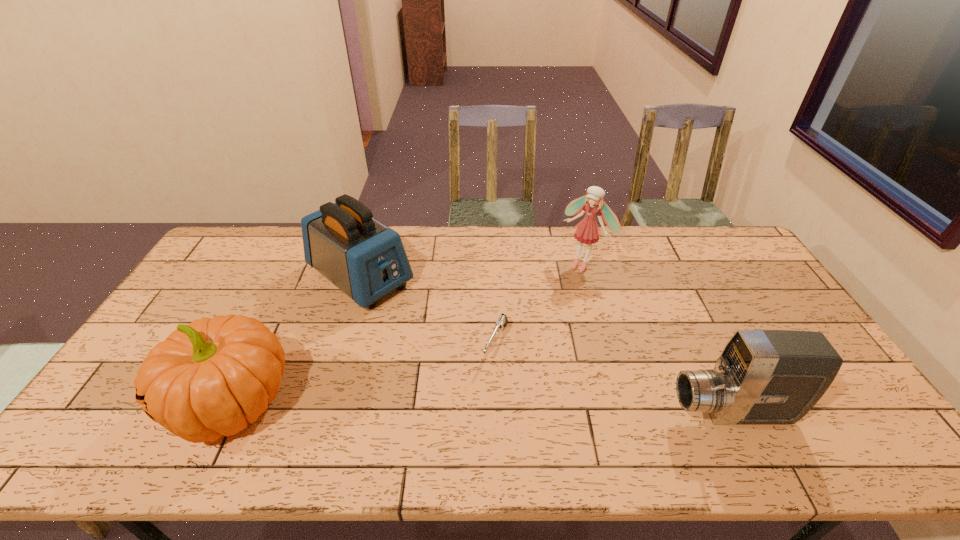
Identify the location of vacant area located at the front of the camcorder, highlighting the lens. This screenshot has height=540, width=960. (x=544, y=413).

Where is `vacant space located at the front of the camcorder, highlighting the lens`? This screenshot has height=540, width=960. vacant space located at the front of the camcorder, highlighting the lens is located at coordinates (569, 413).

Find the location of a particular element. The width and height of the screenshot is (960, 540). free space located on the front-facing side of the second object from right to left is located at coordinates [x=543, y=306].

Where is `free spot located on the front-facing side of the second object from right to left`? The image size is (960, 540). free spot located on the front-facing side of the second object from right to left is located at coordinates (564, 282).

At what (x,y) coordinates should I click in order to perform the action: click on free spot located 0.070m on the front-facing side of the second object from right to left. Please return your answer as a coordinate pair (x, y). Looking at the image, I should click on (562, 285).

The image size is (960, 540). I want to click on vacant space located on the front-facing side of the shortest object, so 474,401.

The image size is (960, 540). In order to click on vacant space situated on the front-facing side of the shortest object in this screenshot , I will do `click(477, 395)`.

Where is `free space located 0.070m on the front-facing side of the shortest object`? free space located 0.070m on the front-facing side of the shortest object is located at coordinates (482, 386).

Locate an element on the screen. This screenshot has height=540, width=960. vacant region located on the front-facing side of the toaster is located at coordinates (474, 362).

At what (x,y) coordinates should I click in order to perform the action: click on free space located 0.080m on the front-facing side of the toaster. Please return your answer as a coordinate pair (x, y). This screenshot has height=540, width=960. Looking at the image, I should click on (412, 316).